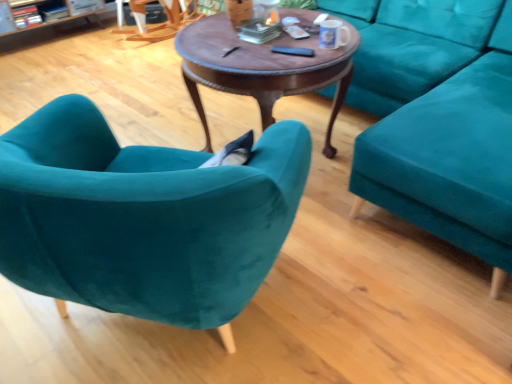
Find the location of a particular element. velvet teal armchair at left is located at coordinates (143, 217).

The width and height of the screenshot is (512, 384). Identify the location of black matte remote control at center, which is counted as the 2th remote control, starting from the back. (293, 51).

The image size is (512, 384). Find the location of `white glossy mug at upper center`. white glossy mug at upper center is located at coordinates (333, 34).

The width and height of the screenshot is (512, 384). I want to click on velvet teal armchair at left, so click(143, 217).

Is teal velvet couch at right smaller than white glossy mug at upper center?

No.

Which of these two, teal velvet couch at right or white glossy mug at upper center, stands taller?

Standing taller between the two is teal velvet couch at right.

Does teal velvet couch at right appear on the left side of white glossy mug at upper center?

Incorrect, teal velvet couch at right is not on the left side of white glossy mug at upper center.

Find the location of a particular element. The width and height of the screenshot is (512, 384). coffee cup above the teal velvet couch at right (from the image's perspective) is located at coordinates (333, 34).

Which is more to the right, white glossy mug at upper center or black matte remote control at center, which is counted as the 2th remote control, starting from the back?

Positioned to the right is white glossy mug at upper center.

From the image's perspective, is white glossy mug at upper center over black matte remote control at center, which is the first remote control in front-to-back order?

Yes, from the image's perspective, white glossy mug at upper center is above black matte remote control at center, which is the first remote control in front-to-back order.

Is white glossy mug at upper center wider or thinner than black matte remote control at center, arranged as the second remote control when viewed from the top?

Clearly, white glossy mug at upper center has more width compared to black matte remote control at center, arranged as the second remote control when viewed from the top.

From a real-world perspective, is white plastic remote control at center, the 2th remote control in the bottom-to-top sequence, positioned over wooden rocking chair at upper left based on gravity?

Correct, in the physical world, white plastic remote control at center, the 2th remote control in the bottom-to-top sequence, is higher than wooden rocking chair at upper left.

Consider the image. Which is in front, white plastic remote control at center, which appears as the first remote control when viewed from the top, or wooden rocking chair at upper left?

white plastic remote control at center, which appears as the first remote control when viewed from the top, is in front.

Which object is wider, white plastic remote control at center, the 2th remote control in the bottom-to-top sequence, or wooden rocking chair at upper left?

wooden rocking chair at upper left is wider.

Would you say white plastic remote control at center, which is the second remote control in front-to-back order, contains wooden rocking chair at upper left?

Definitely not — wooden rocking chair at upper left is not inside white plastic remote control at center, which is the second remote control in front-to-back order.

Between teal velvet couch at right and white plastic remote control at center, the 2th remote control in the bottom-to-top sequence, which one has smaller size?

With smaller size is white plastic remote control at center, the 2th remote control in the bottom-to-top sequence.

Between teal velvet couch at right and white plastic remote control at center, arranged as the first remote control when viewed from the back, which one has smaller width?

white plastic remote control at center, arranged as the first remote control when viewed from the back, is thinner.

How far apart are teal velvet couch at right and white plastic remote control at center, arranged as the first remote control when viewed from the back?

The distance of teal velvet couch at right from white plastic remote control at center, arranged as the first remote control when viewed from the back, is 33.37 inches.

Relative to white plastic remote control at center, which is the second remote control in front-to-back order, is teal velvet couch at right in front or behind?

Visually, teal velvet couch at right is located in front of white plastic remote control at center, which is the second remote control in front-to-back order.

Considering the relative sizes of white glossy mug at upper center and velvet teal armchair at left in the image provided, is white glossy mug at upper center wider than velvet teal armchair at left?

No, white glossy mug at upper center is not wider than velvet teal armchair at left.

From the image's perspective, between white glossy mug at upper center and velvet teal armchair at left, which one is located above?

white glossy mug at upper center appears higher in the image.

Based on the photo, could you tell me if white glossy mug at upper center is turned towards velvet teal armchair at left?

No, white glossy mug at upper center does not turn towards velvet teal armchair at left.

From a real-world perspective, is white glossy mug at upper center on velvet teal armchair at left?

Yes, from a real-world perspective, white glossy mug at upper center is on top of velvet teal armchair at left.

Identify the location of studio couch directly beneath the white glossy mug at upper center (from a real-world perspective). Image resolution: width=512 pixels, height=384 pixels. pyautogui.click(x=441, y=123).

Which is more to the left, white glossy mug at upper center or teal velvet couch at right?

white glossy mug at upper center.

Is white glossy mug at upper center surrounding teal velvet couch at right?

No, teal velvet couch at right is not inside white glossy mug at upper center.

Does white glossy mug at upper center turn towards teal velvet couch at right?

Yes, white glossy mug at upper center is turned towards teal velvet couch at right.

Considering the positions of points (458, 185) and (300, 53), is point (458, 185) closer to camera compared to point (300, 53)?

Yes, it is.

In the image, there is a black matte remote control at center, which is counted as the 2th remote control, starting from the back. At what (x,y) coordinates should I click in order to perform the action: click on studio couch below it (from the image's perspective). Please return your answer as a coordinate pair (x, y). Image resolution: width=512 pixels, height=384 pixels. Looking at the image, I should click on (441, 123).

From a real-world perspective, between teal velvet couch at right and black matte remote control at center, which is counted as the 2th remote control, starting from the back, who is vertically lower?

teal velvet couch at right, from a real-world perspective.

Could you tell me if teal velvet couch at right is facing black matte remote control at center, which is counted as the 2th remote control, starting from the back?

No, teal velvet couch at right is not turned towards black matte remote control at center, which is counted as the 2th remote control, starting from the back.

Locate an element on the screen. coffee cup lying behind the teal velvet couch at right is located at coordinates (333, 34).

Locate an element on the screen. The image size is (512, 384). remote control in front of the white glossy mug at upper center is located at coordinates (293, 51).

Based on their spatial positions, is white plastic remote control at center, which appears as the first remote control when viewed from the top, or velvet teal armchair at left closer to wooden rocking chair at upper left?

Among the two, white plastic remote control at center, which appears as the first remote control when viewed from the top, is located nearer to wooden rocking chair at upper left.

When comparing their distances from teal velvet couch at right, does black matte remote control at center, arranged as the second remote control when viewed from the top, or white plastic remote control at center, which appears as the first remote control when viewed from the top, seem further?

white plastic remote control at center, which appears as the first remote control when viewed from the top, is further to teal velvet couch at right.

Estimate the real-world distances between objects in this image. Which object is closer to white glossy mug at upper center, white plastic remote control at center, arranged as the first remote control when viewed from the back, or velvet teal armchair at left?

The object closer to white glossy mug at upper center is white plastic remote control at center, arranged as the first remote control when viewed from the back.

Estimate the real-world distances between objects in this image. Which object is closer to velvet teal armchair at left, white plastic remote control at center, which is the second remote control in front-to-back order, or white glossy mug at upper center?

Based on the image, white glossy mug at upper center appears to be nearer to velvet teal armchair at left.

Based on their spatial positions, is velvet teal armchair at left or white glossy mug at upper center further from wooden rocking chair at upper left?

velvet teal armchair at left.

Estimate the real-world distances between objects in this image. Which object is further from velvet teal armchair at left, black matte remote control at center, arranged as the second remote control when viewed from the top, or wooden rocking chair at upper left?

wooden rocking chair at upper left is positioned further to the anchor velvet teal armchair at left.

Based on their spatial positions, is white glossy mug at upper center or velvet teal armchair at left closer to black matte remote control at center, arranged as the first remote control when ordered from the bottom?

white glossy mug at upper center is positioned closer to the anchor black matte remote control at center, arranged as the first remote control when ordered from the bottom.

From the image, which object appears to be farther from velvet teal armchair at left, white glossy mug at upper center or white plastic remote control at center, arranged as the first remote control when viewed from the back?

The object further to velvet teal armchair at left is white plastic remote control at center, arranged as the first remote control when viewed from the back.

At what (x,y) coordinates should I click in order to perform the action: click on remote control located between velvet teal armchair at left and white glossy mug at upper center in the depth direction. Please return your answer as a coordinate pair (x, y). Looking at the image, I should click on (293, 51).

At what (x,y) coordinates should I click in order to perform the action: click on coffee cup between black matte remote control at center, arranged as the second remote control when viewed from the top, and wooden rocking chair at upper left in the front-back direction. Please return your answer as a coordinate pair (x, y). The width and height of the screenshot is (512, 384). Looking at the image, I should click on (333, 34).

Find the location of a particular element. The image size is (512, 384). remote control between black matte remote control at center, which is counted as the 2th remote control, starting from the back, and white glossy mug at upper center is located at coordinates (296, 31).

Identify the location of coffee cup located between velvet teal armchair at left and white plastic remote control at center, the 2th remote control in the bottom-to-top sequence, in the depth direction. (333, 34).